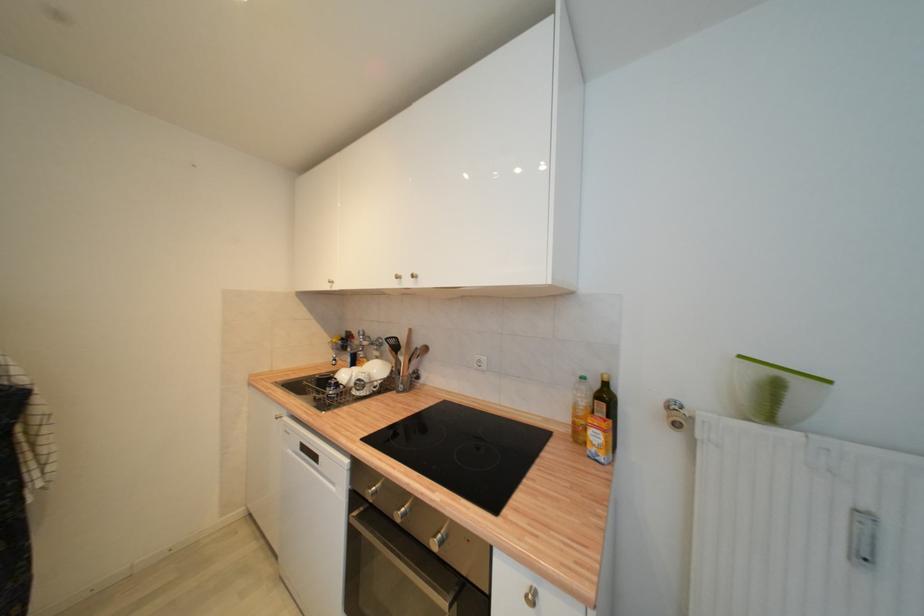
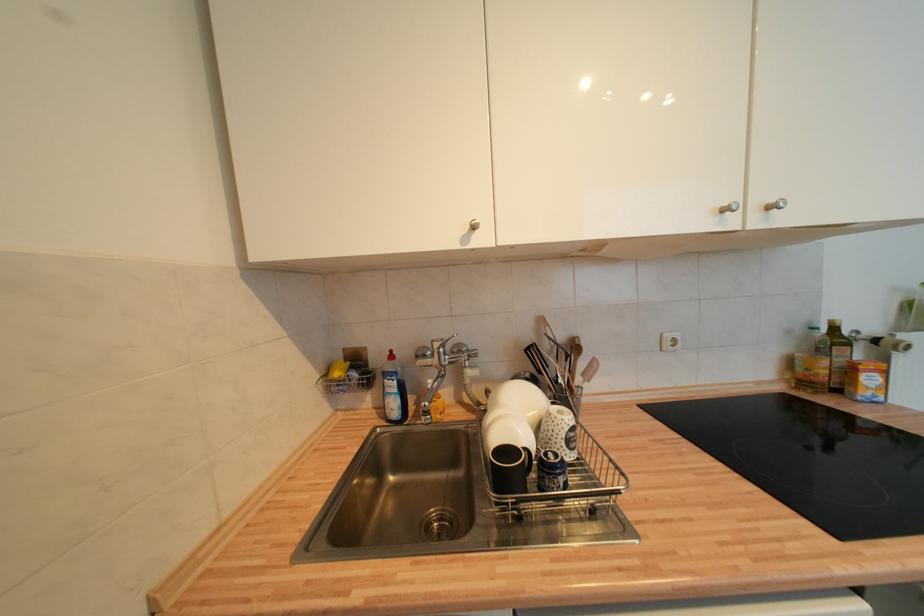
In the second image, find the point that corresponds to pixel 599 447 in the first image.

(873, 391)